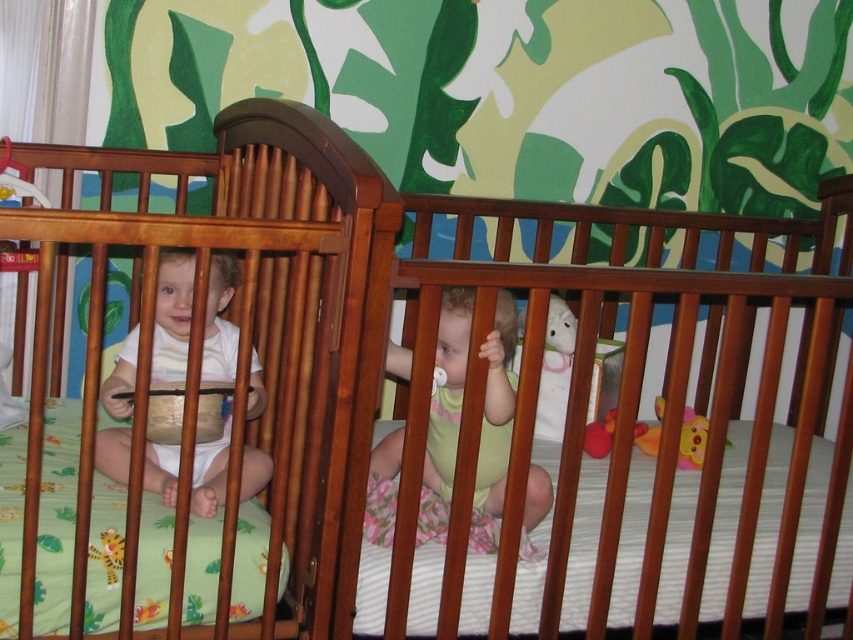
Is point (73, 429) closer to viewer compared to point (703, 436)?

That is True.

The height and width of the screenshot is (640, 853). What are the coordinates of `wooden crib at center` in the screenshot? It's located at (233, 413).

Describe the element at coordinates (233, 413) in the screenshot. I see `wooden crib at center` at that location.

Which is behind, point (346, 600) or point (608, 440)?

Positioned behind is point (608, 440).

Who is more distant from viewer, (396, 195) or (637, 420)?

Positioned behind is point (637, 420).

At what (x,y) coordinates should I click in order to perform the action: click on wooden crib at center. Please return your answer as a coordinate pair (x, y). Looking at the image, I should click on (233, 413).

Between wooden crib at center and white matte baby at left, which one has less height?

white matte baby at left

Does wooden crib at center have a smaller size compared to white matte baby at left?

No.

Image resolution: width=853 pixels, height=640 pixels. What do you see at coordinates (233, 413) in the screenshot?
I see `wooden crib at center` at bounding box center [233, 413].

Where is `wooden crib at center`? Image resolution: width=853 pixels, height=640 pixels. wooden crib at center is located at coordinates (233, 413).